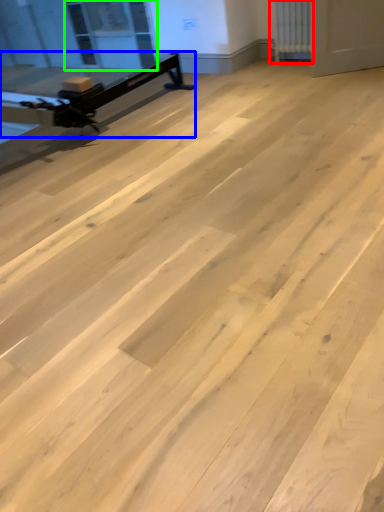
Question: Which is nearer to the radiator (highlighted by a red box)? furniture (highlighted by a blue box) or window screen (highlighted by a green box).

Choices:
 (A) furniture
 (B) window screen

Answer: (A)